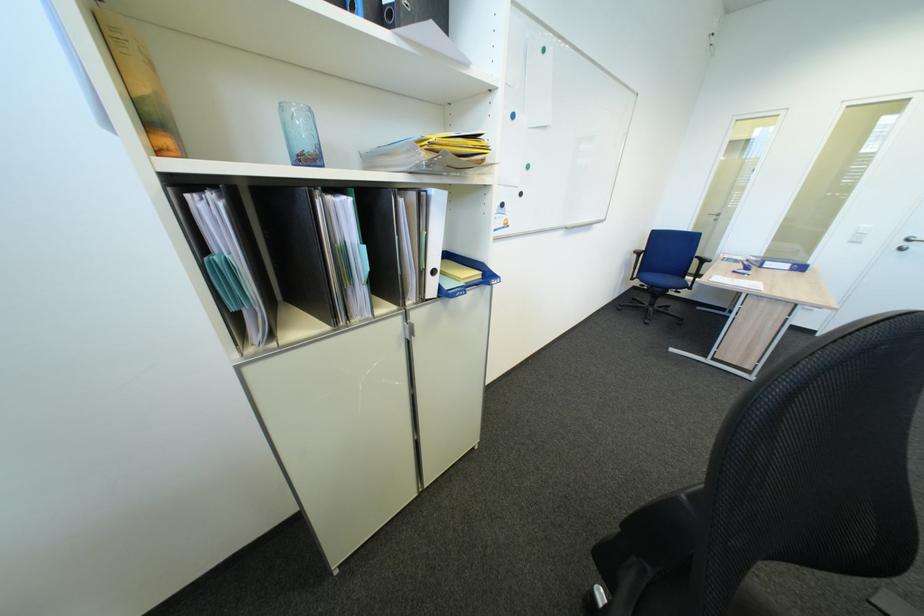
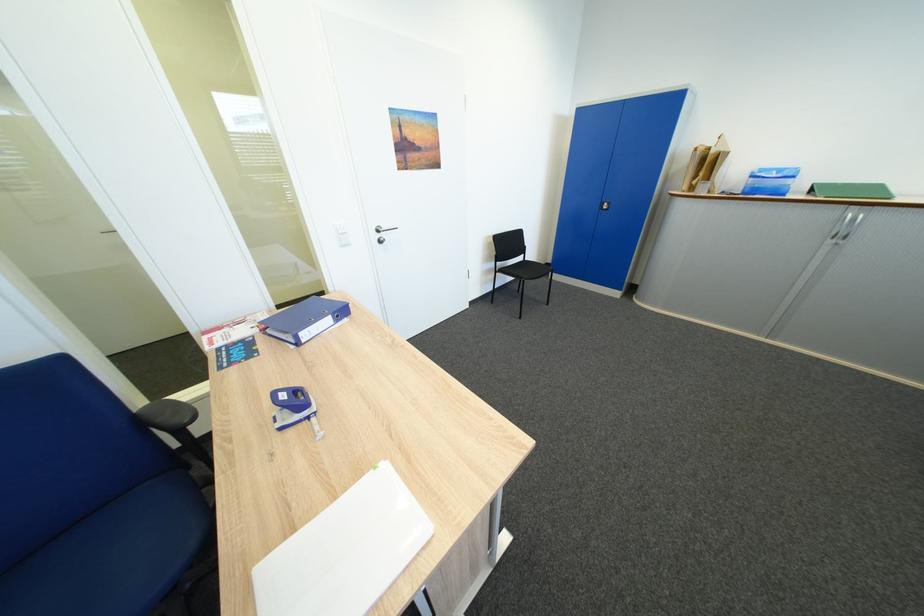
In the second image, find the point that corresponds to [776,264] in the first image.

(310, 334)